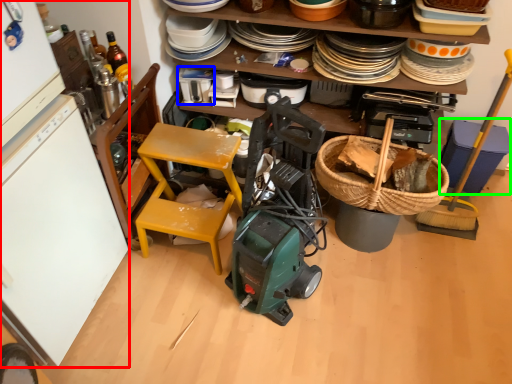
Question: Which object is positioned closest to refrigerator (highlighted by a red box)? Select from appliance (highlighted by a blue box) and appliance (highlighted by a green box).

Choices:
 (A) appliance
 (B) appliance

Answer: (A)